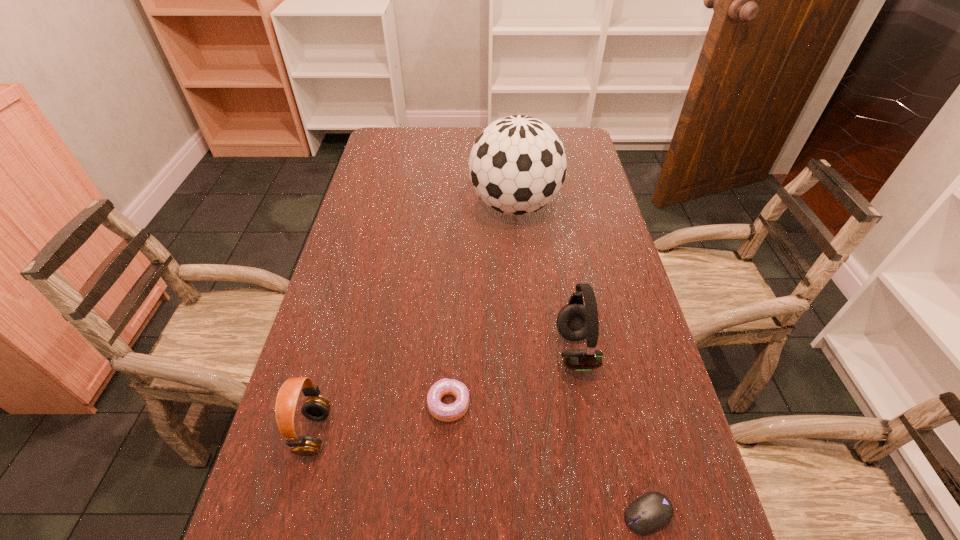
Find the location of `soccer ball`. soccer ball is located at coordinates (x=517, y=165).

Locate an element on the screen. the farthest object is located at coordinates (517, 165).

Identify the location of the second farthest object. (575, 321).

Where is `the farther headset`? Image resolution: width=960 pixels, height=540 pixels. the farther headset is located at coordinates click(x=575, y=321).

Find the location of a particular element. This screenshot has height=540, width=960. the nearer headset is located at coordinates (316, 407).

At what (x,y) coordinates should I click in order to perform the action: click on the left headset. Please return your answer as a coordinate pair (x, y). The image size is (960, 540). Looking at the image, I should click on (316, 407).

Locate an element on the screen. This screenshot has height=540, width=960. the second shortest object is located at coordinates (447, 413).

Locate an element on the screen. Image resolution: width=960 pixels, height=540 pixels. the shortest object is located at coordinates (653, 510).

The width and height of the screenshot is (960, 540). I want to click on computer mouse, so click(653, 510).

Find the location of a particular element. The height and width of the screenshot is (540, 960). free point located on the back of the farthest object is located at coordinates (510, 156).